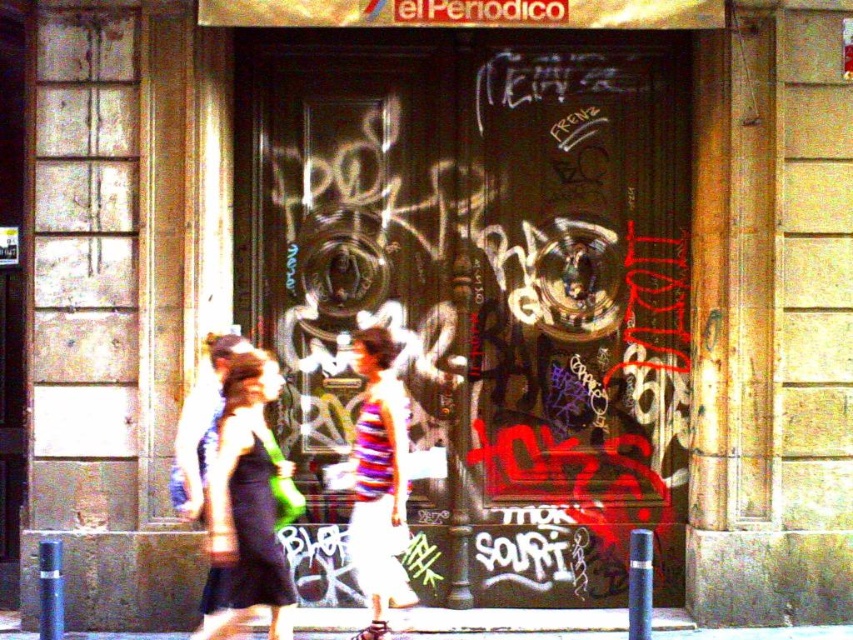
You are standing on the street and see both the matte black dress at center and the striped fabric dress at center. Which one is nearer to you?

The matte black dress at center is closer to the viewer than the striped fabric dress at center.

You are a photographer trying to capture the graffiti on the store door while also including both the matte black dress at center and the striped fabric dress at center in the frame. Based on their positions, which dress should you focus on first to ensure both are in the shot?

The matte black dress at center is located below the striped fabric dress at center, so you should focus on the striped fabric dress at center first to ensure both are in the shot.